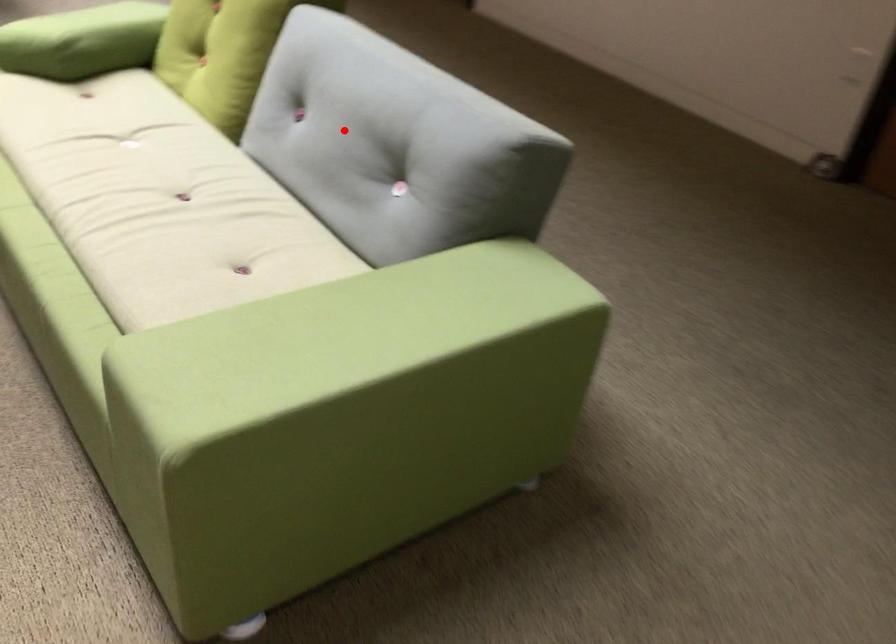
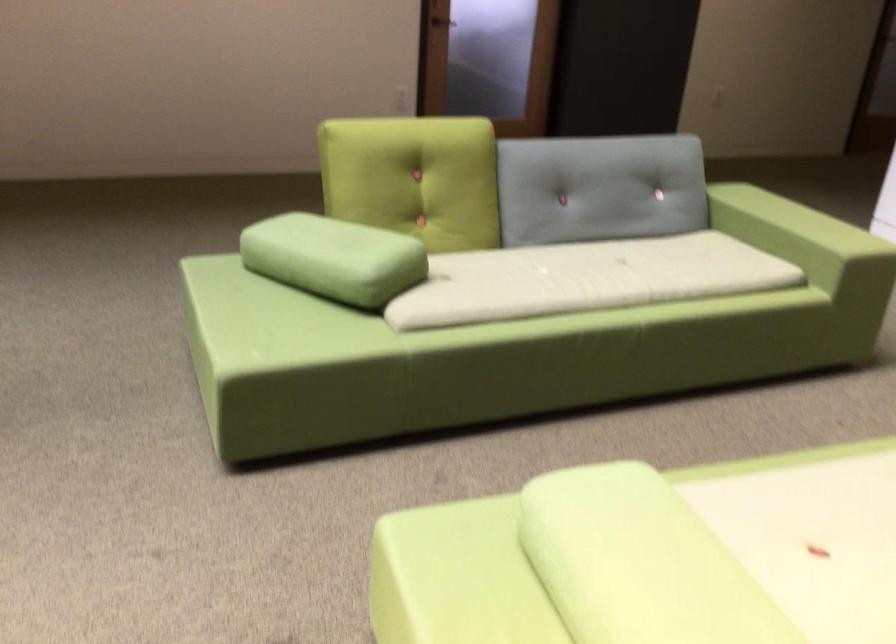
Question: I am providing you with two images of the same scene from different viewpoints. Image1 has a red point marked. In image2, the corresponding 3D location appears at what relative position? Reply with the corresponding letter.

Choices:
 (A) Closer
 (B) Farther

Answer: (B)